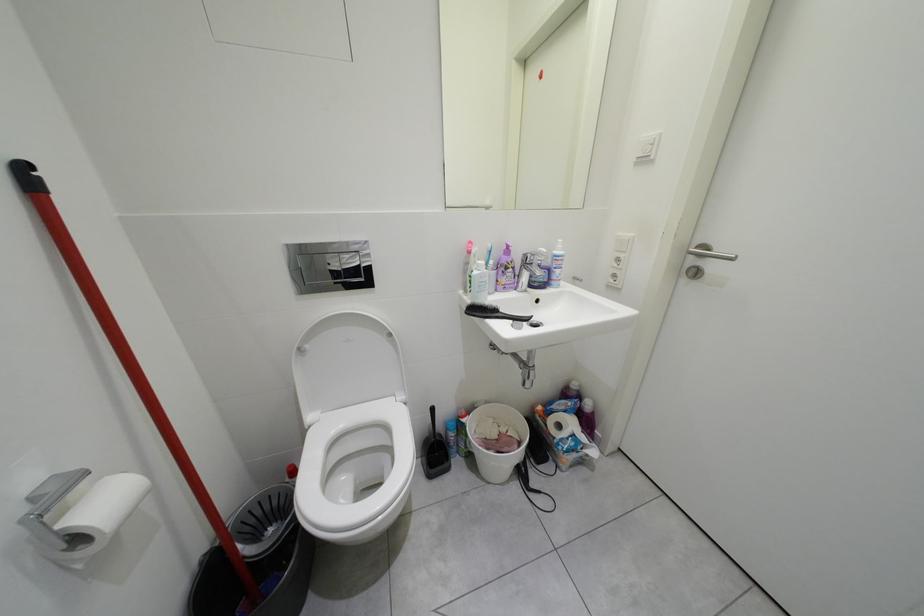
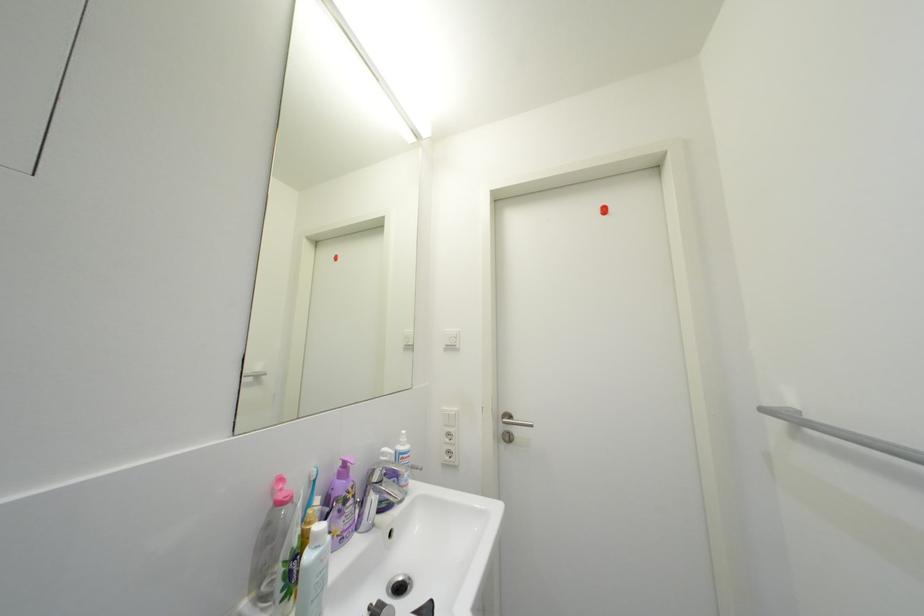
The images are taken continuously from a first-person perspective. In which direction is your viewpoint rotating?

The camera rotated toward right-up.